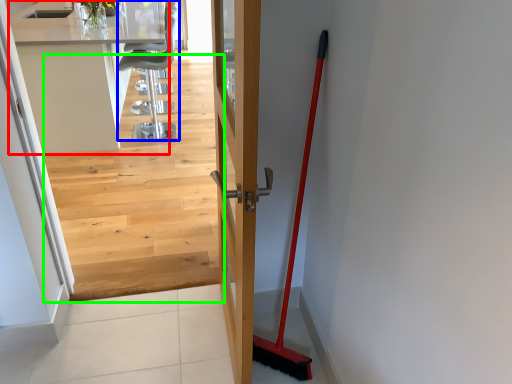
Question: Which object is the farthest from counter top (highlighted by a red box)? Choose among these: chair (highlighted by a blue box) or stairwell (highlighted by a green box).

Choices:
 (A) chair
 (B) stairwell

Answer: (B)